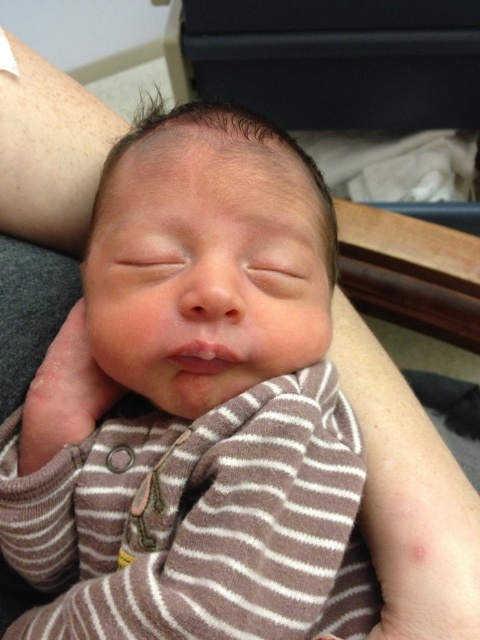
You are a nurse in a hospital. You need to place a medical tag on the brown striped onesie at center. Where exactly should you place the tag so that it is near the bottom left corner of the image?

The small yellow tag is already placed near the bottom left corner of the image on the brown striped onesie at center.